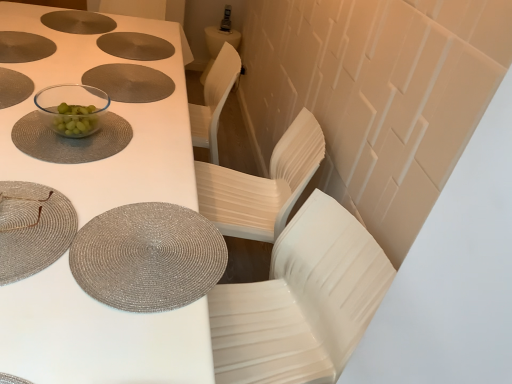
The image size is (512, 384). In order to click on free space above silver textured placemat at lower left, the fourth tableware positioned from the back (from a real-world perspective) in this screenshot , I will do `click(152, 243)`.